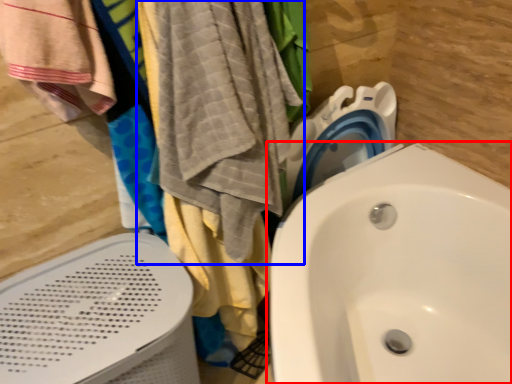
Question: Among these objects, which one is nearest to the camera, sink (highlighted by a red box) or beach towel (highlighted by a blue box)?

Choices:
 (A) sink
 (B) beach towel

Answer: (A)